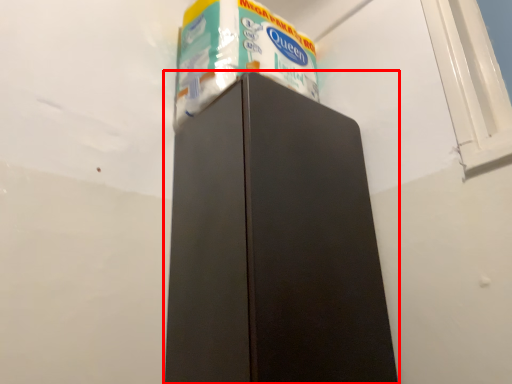
Question: From the image, what is the correct spatial relationship of refrigerator (annotated by the red box) in relation to toilet paper?

Choices:
 (A) right
 (B) left

Answer: (A)